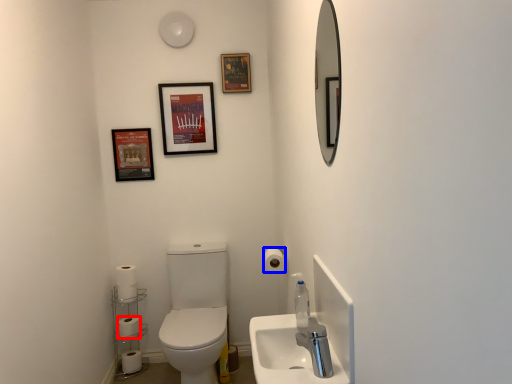
Question: Which object appears closest to the camera in this image, toilet paper (highlighted by a red box) or toilet paper (highlighted by a blue box)?

Choices:
 (A) toilet paper
 (B) toilet paper

Answer: (B)